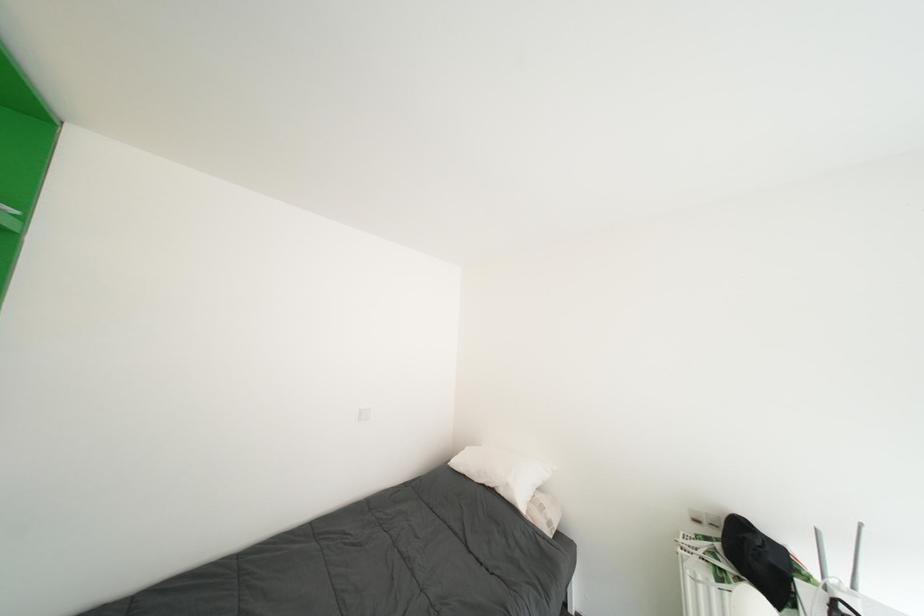
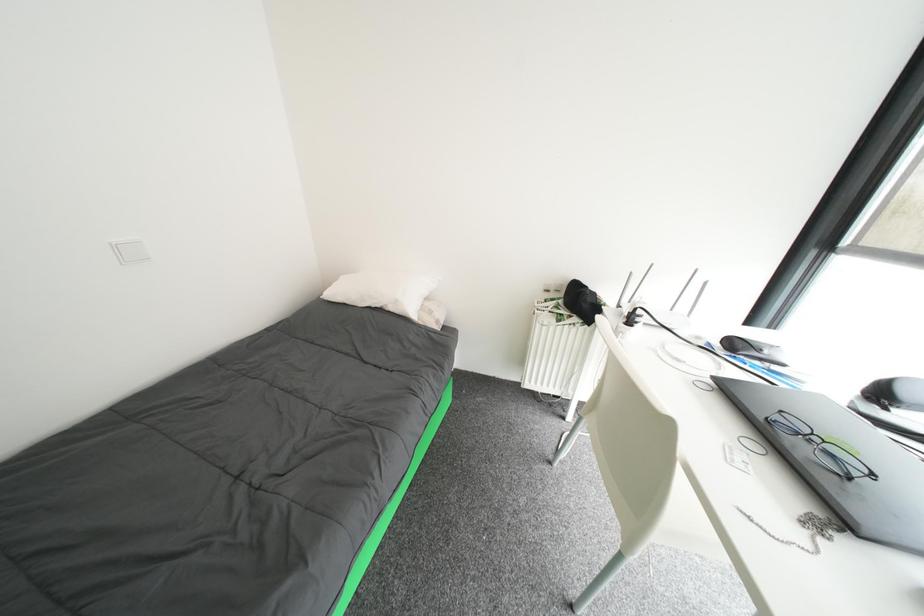
The first image is from the beginning of the video and the second image is from the end. How did the camera likely rotate when shooting the video?

The rotation direction of the camera is right-down.